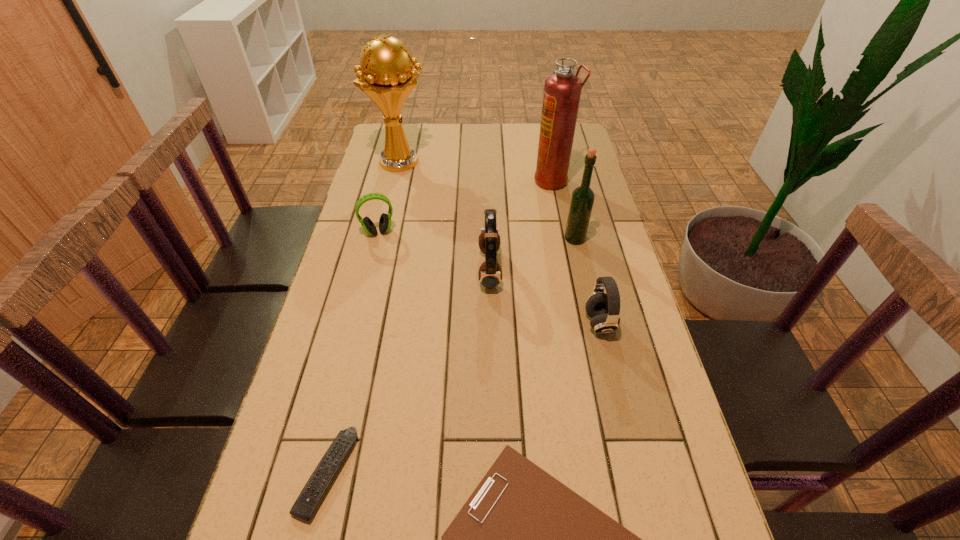
Where is `vacant space located on the side of the fire extinguisher with the label`? This screenshot has height=540, width=960. vacant space located on the side of the fire extinguisher with the label is located at coordinates (441, 180).

Identify the location of free spot located 0.230m on the side of the fire extinguisher with the label. (468, 180).

You are a GUI agent. You are given a task and a screenshot of the screen. Output one action in this format:
    pyautogui.click(x=<x>, y=<y>)
    Task: Click on the vacant position located 0.130m on the side of the fire extinguisher with the label
    
    Given the screenshot: What is the action you would take?
    pyautogui.click(x=497, y=180)

At what (x,y) coordinates should I click in order to perform the action: click on free location located on the left of the third tallest object. Please return your answer as a coordinate pair (x, y). This screenshot has height=540, width=960. Looking at the image, I should click on (479, 239).

Locate an element on the screen. This screenshot has width=960, height=540. vacant space located 0.320m on the ear cup of the tallest headset is located at coordinates (366, 270).

The image size is (960, 540). I want to click on free space located on the ear cup of the tallest headset, so click(397, 270).

At what (x,y) coordinates should I click in order to perform the action: click on free spot located on the ear cup of the tallest headset. Please return your answer as a coordinate pair (x, y). Looking at the image, I should click on (355, 270).

What are the coordinates of `blank space located on the ear cups of the rightmost headset` in the screenshot? It's located at (446, 323).

At what (x,y) coordinates should I click in order to perform the action: click on vacant position located 0.120m on the ear cups of the rightmost headset. Please return your answer as a coordinate pair (x, y). Looking at the image, I should click on tap(537, 323).

The width and height of the screenshot is (960, 540). Identify the location of free space located 0.360m on the ear cups of the rightmost headset. (443, 323).